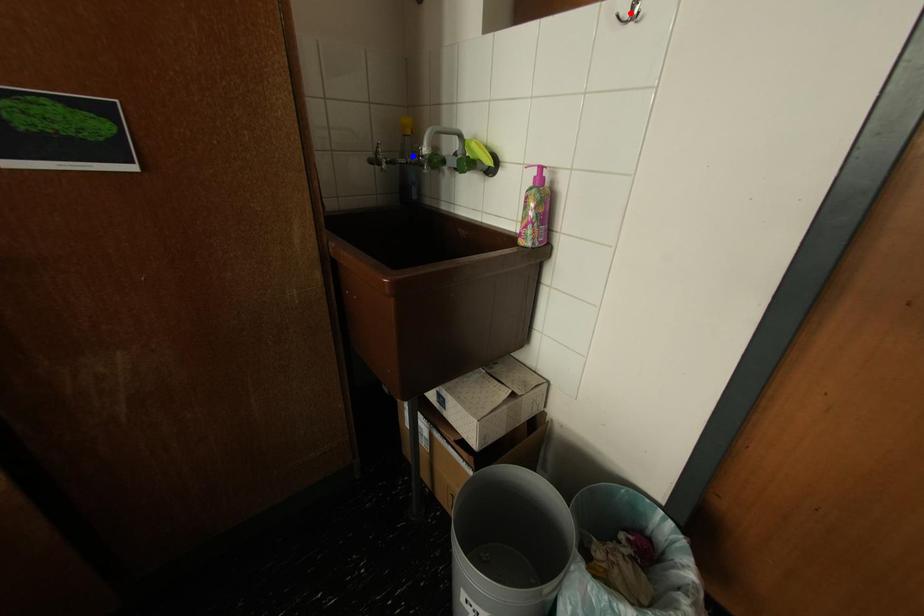
Question: Which of the two points in the image is closer to the camera?

Choices:
 (A) Blue point is closer.
 (B) Red point is closer.

Answer: (B)